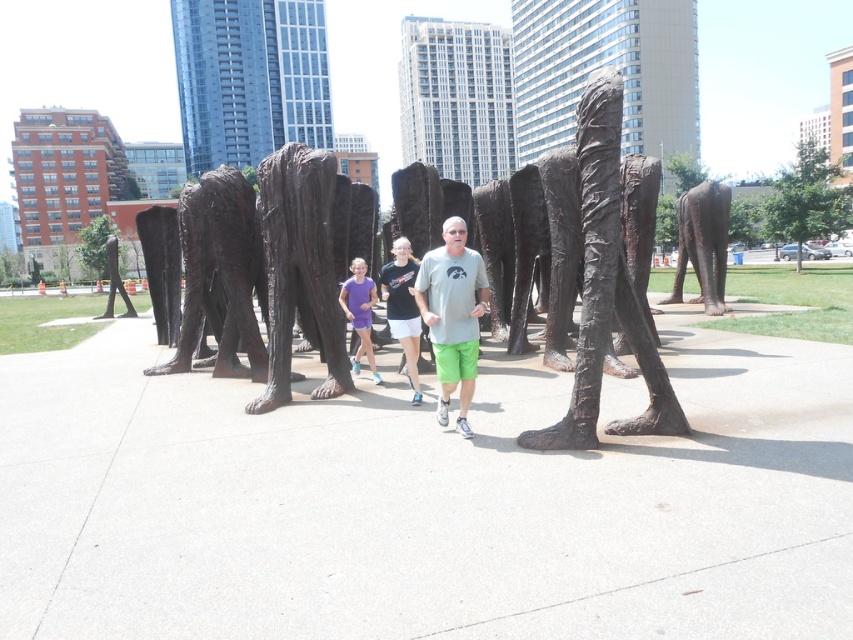
You are a photographer standing in the urban scene. You want to take a photo of the bronze sculpture at center and bronze statue at center so that both are visible in the frame. Which object should you focus on first to ensure both are in the shot?

You should focus on the bronze sculpture at center first because it is positioned under the bronze statue at center, so by centering the bronze sculpture at center in your frame, the bronze statue at center will naturally be included above it.